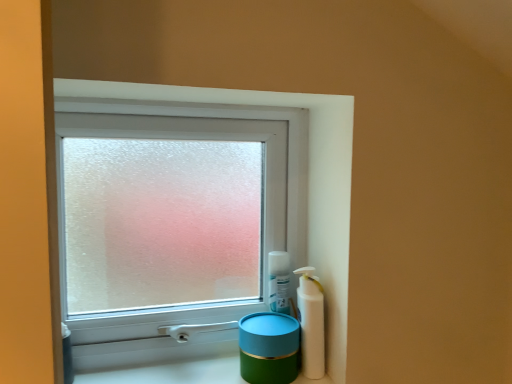
Question: Can you confirm if green matte container at lower center is positioned to the left of white plastic bottle at right?

Choices:
 (A) no
 (B) yes

Answer: (B)

Question: Does green matte container at lower center come in front of white plastic bottle at right?

Choices:
 (A) yes
 (B) no

Answer: (A)

Question: From the image's perspective, is green matte container at lower center on top of white plastic bottle at right?

Choices:
 (A) no
 (B) yes

Answer: (A)

Question: From a real-world perspective, is green matte container at lower center located beneath white plastic bottle at right?

Choices:
 (A) yes
 (B) no

Answer: (A)

Question: Considering the relative positions of green matte container at lower center and white plastic bottle at right in the image provided, is green matte container at lower center to the right of white plastic bottle at right from the viewer's perspective?

Choices:
 (A) yes
 (B) no

Answer: (B)

Question: Is teal glossy jar at lower right to the left or to the right of frosted glass window at center in the image?

Choices:
 (A) right
 (B) left

Answer: (A)

Question: Is point (278, 347) closer or farther from the camera than point (218, 127)?

Choices:
 (A) closer
 (B) farther

Answer: (A)

Question: In the image, is teal glossy jar at lower right positioned in front of or behind frosted glass window at center?

Choices:
 (A) front
 (B) behind

Answer: (A)

Question: From the image's perspective, relative to frosted glass window at center, is teal glossy jar at lower right above or below?

Choices:
 (A) below
 (B) above

Answer: (A)

Question: Considering the relative positions of white plastic bottle at right and frosted glass window at center in the image provided, is white plastic bottle at right to the left or to the right of frosted glass window at center?

Choices:
 (A) left
 (B) right

Answer: (B)

Question: Considering the positions of white plastic bottle at right and frosted glass window at center in the image, is white plastic bottle at right bigger or smaller than frosted glass window at center?

Choices:
 (A) small
 (B) big

Answer: (A)

Question: From a real-world perspective, is white plastic bottle at right positioned above or below frosted glass window at center?

Choices:
 (A) below
 (B) above

Answer: (A)

Question: Is point (316, 304) closer or farther from the camera than point (151, 183)?

Choices:
 (A) farther
 (B) closer

Answer: (B)

Question: From the image's perspective, relative to teal glossy jar at lower right, is green matte container at lower center above or below?

Choices:
 (A) below
 (B) above

Answer: (A)

Question: From their relative heights in the image, would you say green matte container at lower center is taller or shorter than teal glossy jar at lower right?

Choices:
 (A) short
 (B) tall

Answer: (A)